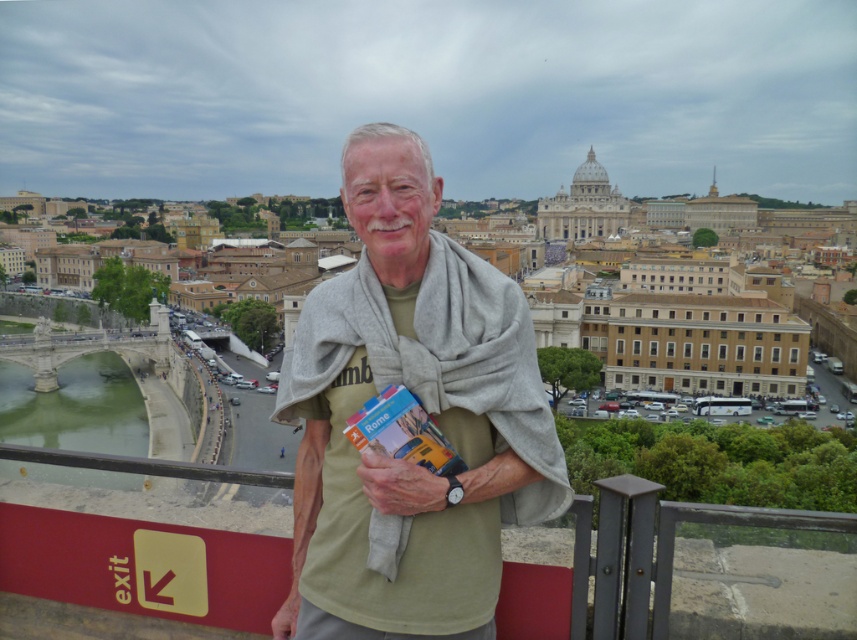
You are a fashion designer observing a tourist in Rome. The tourist is wearing a light green cotton shirt at center and has a light brown leather hand at center. Which item has a greater width?

The light green cotton shirt at center has a greater width than the light brown leather hand at center.